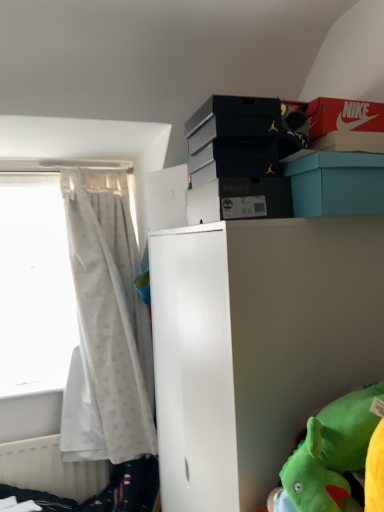
Question: Considering the positions of black matte shoebox at upper center, acting as the 1th storage box starting from the bottom, and teal cardboard box at upper center, the fourth storage box viewed from the top, in the image, is black matte shoebox at upper center, acting as the 1th storage box starting from the bottom, taller or shorter than teal cardboard box at upper center, the fourth storage box viewed from the top,?

Choices:
 (A) tall
 (B) short

Answer: (B)

Question: Is black matte shoebox at upper center, which appears as the 5th storage box when viewed from the top, spatially inside teal cardboard box at upper center, which appears as the second storage box when ordered from the bottom, or outside of it?

Choices:
 (A) inside
 (B) outside

Answer: (B)

Question: Estimate the real-world distances between objects in this image. Which object is farther from the white sheer curtain at left?

Choices:
 (A) black matte shoebox at upper center, acting as the 1th storage box starting from the bottom
 (B) white plastic radiator at lower left
 (C) teal cardboard box at upper center, which appears as the second storage box when ordered from the bottom
 (D) red matte shoebox at upper right, which is the fifth storage box in bottom-to-top order
 (E) black matte shoebox at upper center, arranged as the 3th storage box when viewed from the top

Answer: (D)

Question: Estimate the real-world distances between objects in this image. Which object is closer to the teal cardboard box at upper center, the fourth storage box viewed from the top?

Choices:
 (A) red matte shoebox at upper right, which is the 1th storage box in top-to-bottom order
 (B) white matte cabinet at center
 (C) black matte shoebox at upper center, which appears as the 5th storage box when viewed from the top
 (D) white glossy bed frame at lower left
 (E) white sheer curtain at left

Answer: (A)